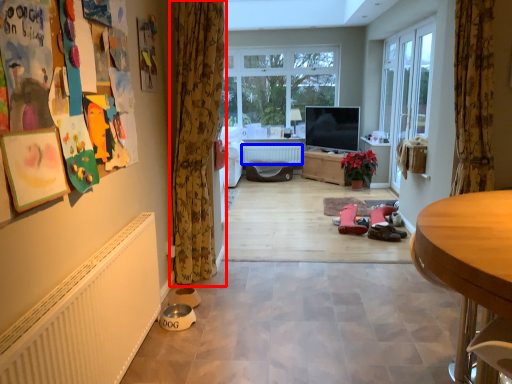
Question: Which object appears farthest to the camera in this image, curtain (highlighted by a red box) or radiator (highlighted by a blue box)?

Choices:
 (A) curtain
 (B) radiator

Answer: (B)